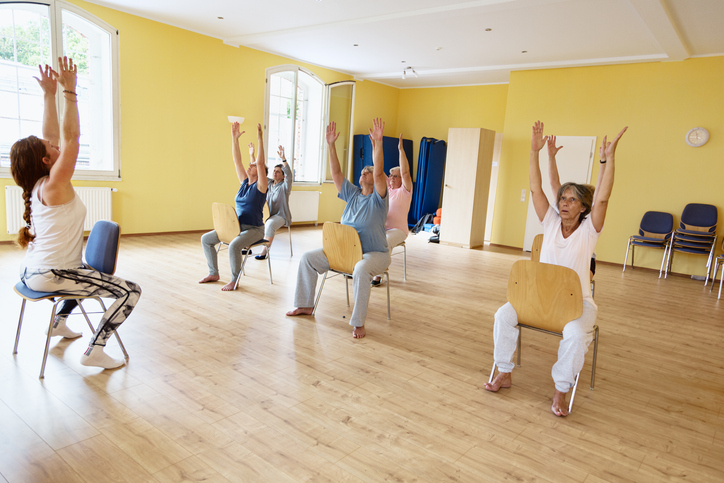
Locate an element on the screen. The width and height of the screenshot is (724, 483). celiling lights is located at coordinates (219, 21), (358, 45), (489, 28), (523, 56), (494, 55), (403, 60), (437, 49).